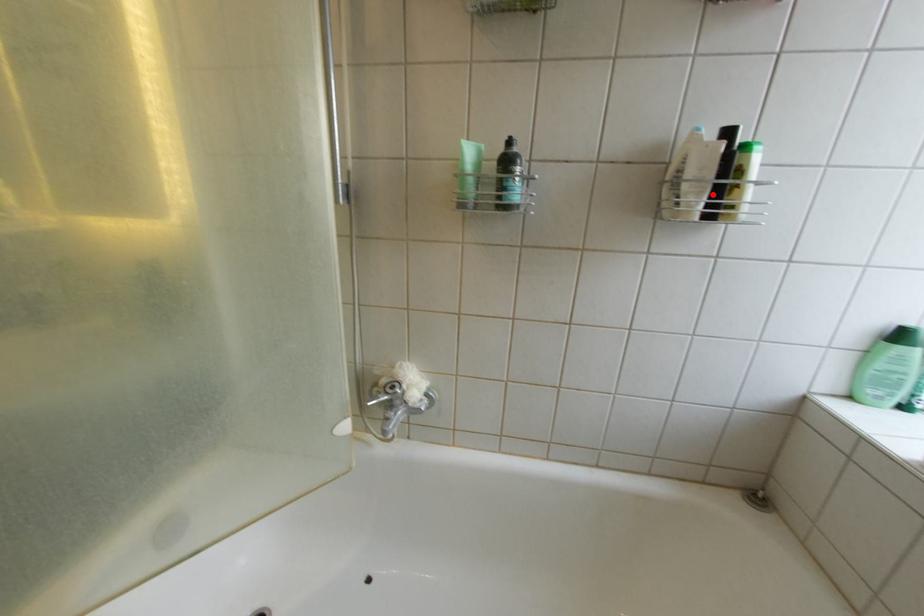
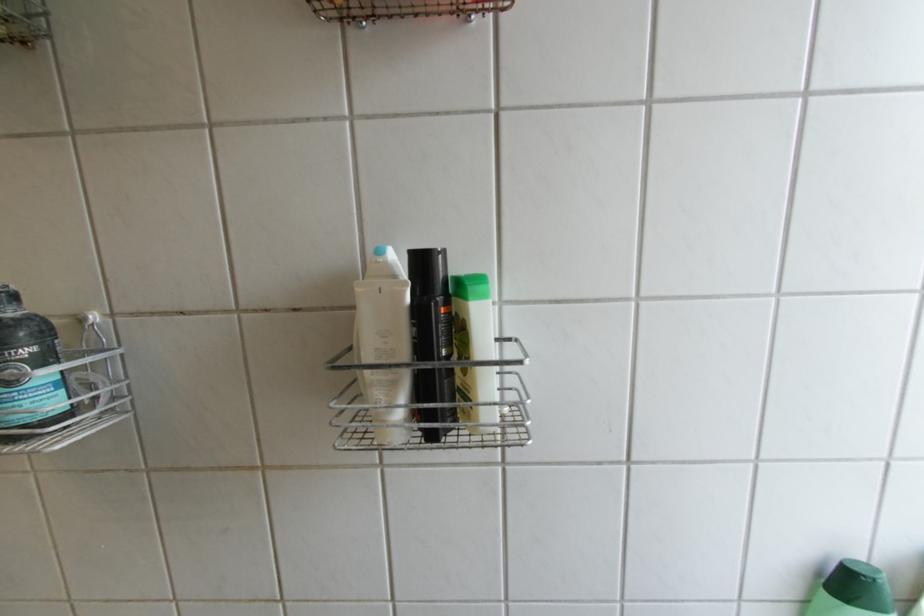
The point at the highlighted location is marked in the first image. Where is the corresponding point in the second image?

(407, 387)